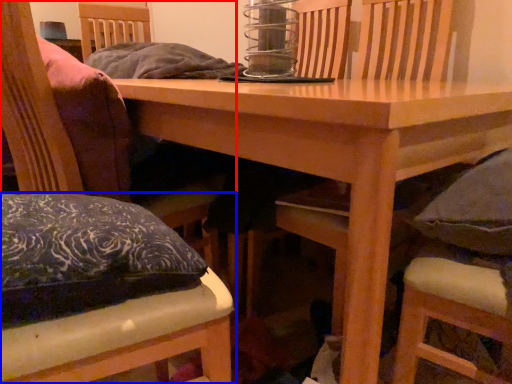
Question: Which object is closer to the camera taking this photo, chair (highlighted by a red box) or chair (highlighted by a blue box)?

Choices:
 (A) chair
 (B) chair

Answer: (A)